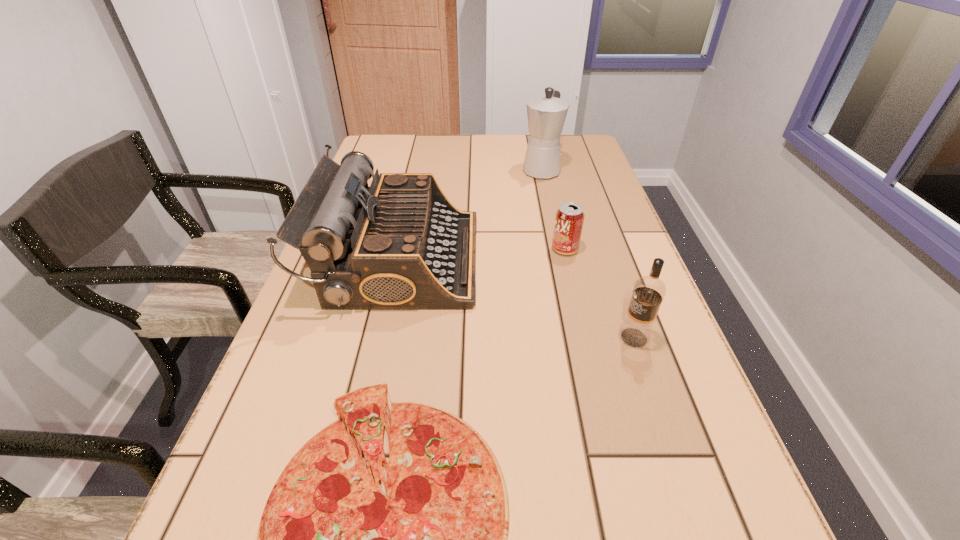
Identify the location of coffeepot. The height and width of the screenshot is (540, 960). (546, 115).

Image resolution: width=960 pixels, height=540 pixels. I want to click on the tallest object, so click(x=546, y=115).

Where is `typewriter`? The image size is (960, 540). typewriter is located at coordinates tap(400, 244).

Image resolution: width=960 pixels, height=540 pixels. What are the coordinates of `the rightmost object` in the screenshot? It's located at (649, 291).

You are a GUI agent. You are given a task and a screenshot of the screen. Output one action in this format:
    pyautogui.click(x=<x>, y=<y>)
    Task: Click on the vodka
    This screenshot has width=960, height=540.
    Given the screenshot: What is the action you would take?
    (649, 291)

This screenshot has height=540, width=960. I want to click on the second shortest object, so click(569, 219).

The image size is (960, 540). I want to click on vacant space positioned 0.070m on the left of the coffeepot, so click(x=499, y=170).

Find the location of a particular element. The height and width of the screenshot is (540, 960). vacant space located on the keyboard of the typewriter is located at coordinates (614, 259).

Identify the location of free location located 0.140m on the label of the fourth farthest object. (547, 338).

The width and height of the screenshot is (960, 540). Find the location of `blank space located on the label of the fourth farthest object`. blank space located on the label of the fourth farthest object is located at coordinates (461, 338).